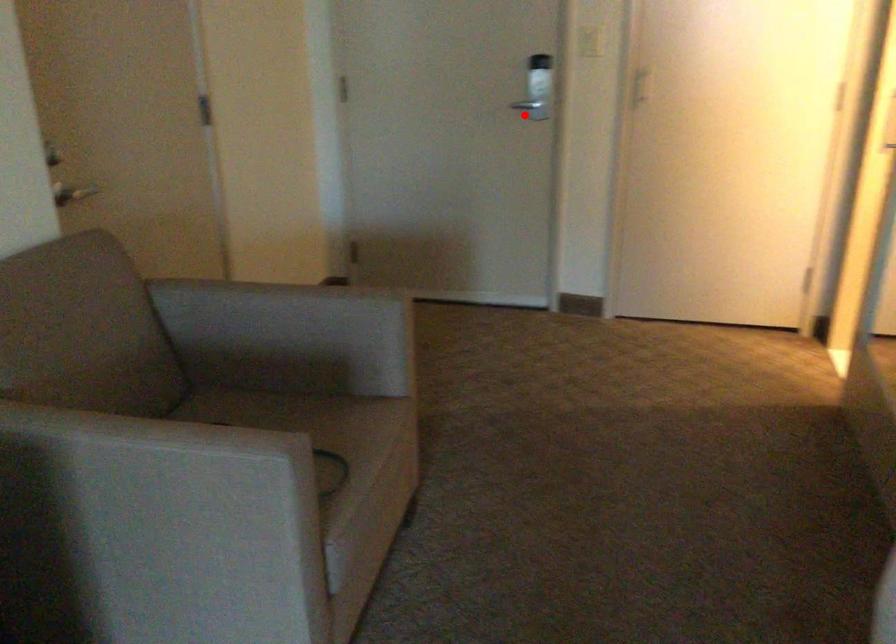
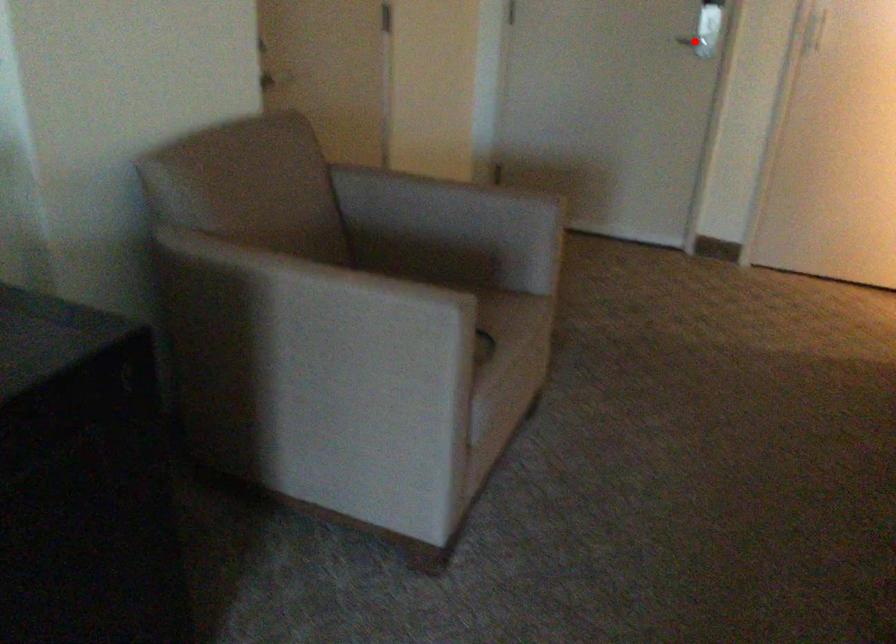
I am providing you with two images of the same scene from different viewpoints. A red point is marked on the first image and another point is marked on the second image. Is the marked point in image1 the same physical position as the marked point in image2?

Yes